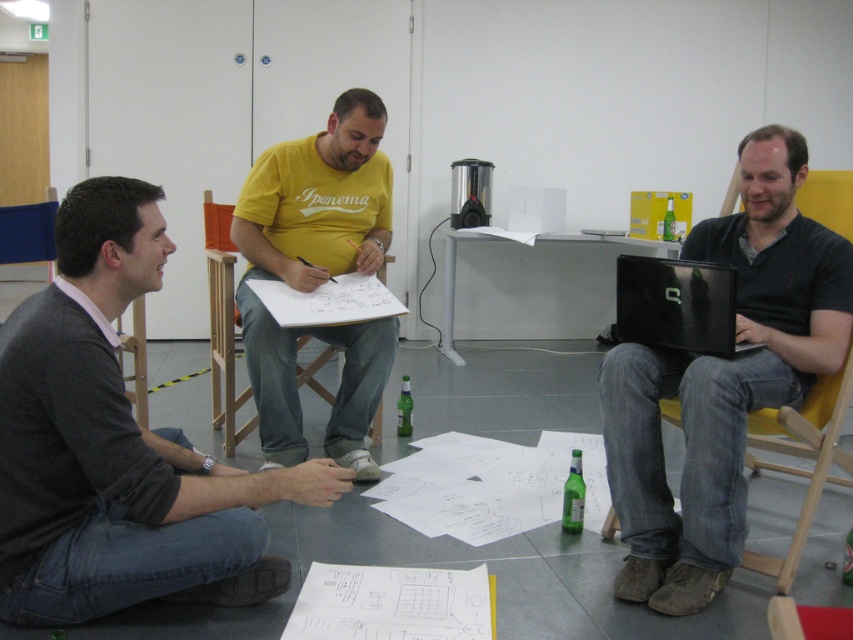
Which is more to the right, yellow cotton shirt at center or black glossy laptop at right?

black glossy laptop at right is more to the right.

Can you confirm if yellow cotton shirt at center is positioned to the left of black glossy laptop at right?

Indeed, yellow cotton shirt at center is positioned on the left side of black glossy laptop at right.

At what (x,y) coordinates should I click in order to perform the action: click on yellow cotton shirt at center. Please return your answer as a coordinate pair (x, y). Looking at the image, I should click on (317, 275).

I want to click on yellow cotton shirt at center, so click(317, 275).

Looking at this image, which is below, dark gray sweater at lower left or matte black laptop at right?

Positioned lower is dark gray sweater at lower left.

Can you confirm if dark gray sweater at lower left is taller than matte black laptop at right?

Incorrect, dark gray sweater at lower left's height is not larger of matte black laptop at right's.

Find the location of a particular element. dark gray sweater at lower left is located at coordinates (117, 445).

Where is `dark gray sweater at lower left`? dark gray sweater at lower left is located at coordinates (117, 445).

Is matte black laptop at right closer to the viewer compared to white plastic table at center?

Yes, matte black laptop at right is in front of white plastic table at center.

Can you confirm if matte black laptop at right is wider than white plastic table at center?

No, matte black laptop at right is not wider than white plastic table at center.

Is point (653, 396) positioned after point (593, 236)?

No, it is not.

At what (x,y) coordinates should I click in order to perform the action: click on matte black laptop at right. Please return your answer as a coordinate pair (x, y). Image resolution: width=853 pixels, height=640 pixels. Looking at the image, I should click on (723, 381).